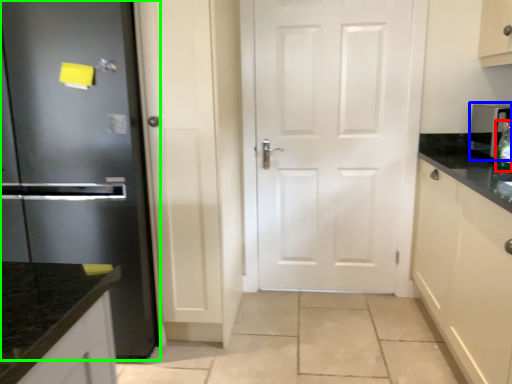
Question: Which is nearer to the bottle (highlighted by a red box)? appliance (highlighted by a blue box) or refrigerator (highlighted by a green box).

Choices:
 (A) appliance
 (B) refrigerator

Answer: (A)